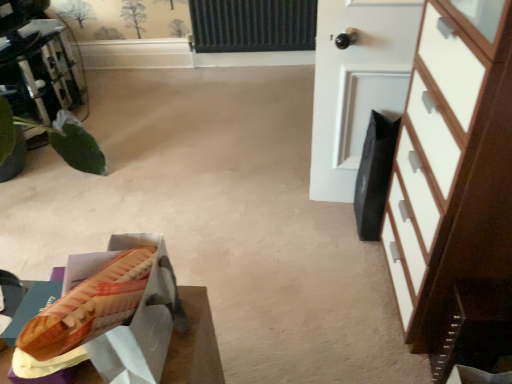
This screenshot has height=384, width=512. What do you see at coordinates (89, 307) in the screenshot?
I see `matte brown hot dog bun at lower left` at bounding box center [89, 307].

The height and width of the screenshot is (384, 512). I want to click on green leafy plant at left, so click(x=44, y=71).

The height and width of the screenshot is (384, 512). What do you see at coordinates (356, 84) in the screenshot?
I see `white matte door at upper right` at bounding box center [356, 84].

What are the coordinates of `white matte door at upper right` in the screenshot? It's located at (x=356, y=84).

I want to click on matte brown hot dog bun at lower left, so click(x=89, y=307).

Is green leafy plant at left at the back of matte brown hot dog bun at lower left?

No, matte brown hot dog bun at lower left is not facing the opposite direction of green leafy plant at left.

Is point (61, 311) closer or farther from the camera than point (54, 63)?

Clearly, point (61, 311) is closer to the camera than point (54, 63).

How far apart are matte brown hot dog bun at lower left and green leafy plant at left?

A distance of 2.50 meters exists between matte brown hot dog bun at lower left and green leafy plant at left.

In the scene shown: From a real-world perspective, does matte brown hot dog bun at lower left stand above white wood chest of drawers at right?

Yes, from a real-world perspective, matte brown hot dog bun at lower left is above white wood chest of drawers at right.

Measure the distance between matte brown hot dog bun at lower left and white wood chest of drawers at right.

78.83 centimeters.

Is matte brown hot dog bun at lower left oriented away from white wood chest of drawers at right?

No, matte brown hot dog bun at lower left is not facing the opposite direction of white wood chest of drawers at right.

Considering the relative sizes of white wood chest of drawers at right and white matte door at upper right in the image provided, is white wood chest of drawers at right bigger than white matte door at upper right?

Correct, white wood chest of drawers at right is larger in size than white matte door at upper right.

From the image's perspective, is white wood chest of drawers at right beneath white matte door at upper right?

Yes.

Is white wood chest of drawers at right located outside white matte door at upper right?

Absolutely, white wood chest of drawers at right is external to white matte door at upper right.

This screenshot has width=512, height=384. Identify the location of chest of drawers in front of the white matte door at upper right. (452, 162).

Is white matte door at upper right placed right next to green leafy plant at left?

white matte door at upper right and green leafy plant at left are clearly separated.

Can you confirm if white matte door at upper right is wider than green leafy plant at left?

Incorrect, the width of white matte door at upper right does not surpass that of green leafy plant at left.

Can we say white matte door at upper right lies outside green leafy plant at left?

That's correct, white matte door at upper right is outside of green leafy plant at left.

Consider the image. Considering the relative positions of white matte door at upper right and green leafy plant at left in the image provided, is white matte door at upper right to the left or to the right of green leafy plant at left?

In the image, white matte door at upper right appears on the right side of green leafy plant at left.

Relative to matte brown hot dog bun at lower left, is white wood chest of drawers at right in front or behind?

white wood chest of drawers at right is in front of matte brown hot dog bun at lower left.

Which point is more distant from viewer, (401,230) or (53,321)?

Point (401,230)

Is white wood chest of drawers at right to the right of matte brown hot dog bun at lower left from the viewer's perspective?

Indeed, white wood chest of drawers at right is positioned on the right side of matte brown hot dog bun at lower left.

Is matte brown hot dog bun at lower left located within white wood chest of drawers at right?

No, matte brown hot dog bun at lower left is located outside of white wood chest of drawers at right.

Is white matte door at upper right spatially inside matte brown hot dog bun at lower left, or outside of it?

white matte door at upper right is not enclosed by matte brown hot dog bun at lower left.

Considering the relative sizes of white matte door at upper right and matte brown hot dog bun at lower left in the image provided, is white matte door at upper right bigger than matte brown hot dog bun at lower left?

Indeed, white matte door at upper right has a larger size compared to matte brown hot dog bun at lower left.

Identify the location of door above the matte brown hot dog bun at lower left (from the image's perspective). The image size is (512, 384). (356, 84).

Are matte brown hot dog bun at lower left and white matte door at upper right making contact?

They are not placed beside each other.

Can white matte door at upper right be found inside matte brown hot dog bun at lower left?

Definitely not — white matte door at upper right is not inside matte brown hot dog bun at lower left.

Is matte brown hot dog bun at lower left taller or shorter than white matte door at upper right?

matte brown hot dog bun at lower left is shorter than white matte door at upper right.

How different are the orientations of matte brown hot dog bun at lower left and white matte door at upper right in degrees?

The facing directions of matte brown hot dog bun at lower left and white matte door at upper right are 171 degrees apart.

In order to click on hot dog lying on the right of green leafy plant at left in this screenshot , I will do `click(89, 307)`.

In order to click on hot dog that appears on the left of white wood chest of drawers at right in this screenshot , I will do `click(89, 307)`.

Looking at the image, which one is located further to white matte door at upper right, white wood chest of drawers at right or green leafy plant at left?

green leafy plant at left lies further to white matte door at upper right than the other object.

In the scene shown: Estimate the real-world distances between objects in this image. Which object is closer to matte brown hot dog bun at lower left, green leafy plant at left or white wood chest of drawers at right?

white wood chest of drawers at right lies closer to matte brown hot dog bun at lower left than the other object.

When comparing their distances from green leafy plant at left, does matte brown hot dog bun at lower left or white matte door at upper right seem closer?

white matte door at upper right is positioned closer to the anchor green leafy plant at left.

From the image, which object appears to be farther from white wood chest of drawers at right, white matte door at upper right or matte brown hot dog bun at lower left?

matte brown hot dog bun at lower left is positioned further to the anchor white wood chest of drawers at right.

Considering their positions, is white wood chest of drawers at right positioned closer to green leafy plant at left than matte brown hot dog bun at lower left?

The object closer to green leafy plant at left is white wood chest of drawers at right.

Estimate the real-world distances between objects in this image. Which object is closer to white matte door at upper right, matte brown hot dog bun at lower left or green leafy plant at left?

matte brown hot dog bun at lower left is closer to white matte door at upper right.

Based on their spatial positions, is green leafy plant at left or white matte door at upper right closer to white wood chest of drawers at right?

Based on the image, white matte door at upper right appears to be nearer to white wood chest of drawers at right.

From the picture: Which object lies nearer to the anchor point matte brown hot dog bun at lower left, green leafy plant at left or white matte door at upper right?

white matte door at upper right lies closer to matte brown hot dog bun at lower left than the other object.

You are a GUI agent. You are given a task and a screenshot of the screen. Output one action in this format:
    pyautogui.click(x=<x>, y=<y>)
    Task: Click on the hot dog between green leafy plant at left and white matte door at upper right in the horizontal direction
    
    Given the screenshot: What is the action you would take?
    pyautogui.click(x=89, y=307)

Locate an element on the screen. This screenshot has height=384, width=512. door between green leafy plant at left and white wood chest of drawers at right from left to right is located at coordinates (356, 84).

Identify the location of hot dog situated between green leafy plant at left and white wood chest of drawers at right from left to right. The height and width of the screenshot is (384, 512). 89,307.

In order to click on door located between matte brown hot dog bun at lower left and white wood chest of drawers at right in the left-right direction in this screenshot , I will do `click(356, 84)`.